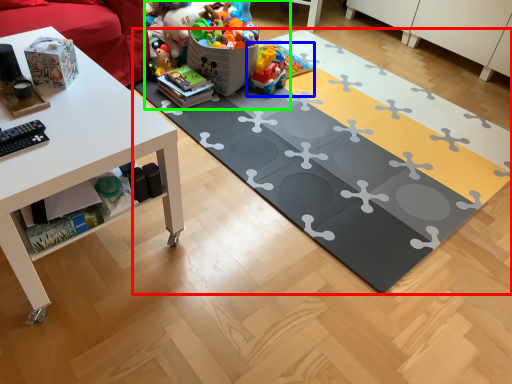
Question: Which object is the farthest from yoga mat (highlighted by a red box)? Choose among these: toy (highlighted by a blue box) or toy (highlighted by a green box).

Choices:
 (A) toy
 (B) toy

Answer: (A)